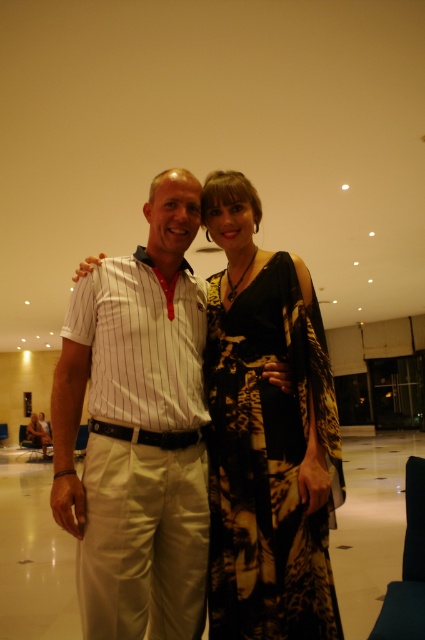
You are standing in a hotel lobby and see two people dressed in a white striped shirt at center and a black printed dress at center. Which one is positioned more to the left?

The white striped shirt at center is positioned more to the left than the black printed dress at center.

You are a photographer setting up a shoot in a hotel lobby. You notice two subjects wearing a white striped shirt at center and a black printed dress at center. Based on their heights, which clothing item should you adjust the camera angle for to ensure both are framed properly?

The white striped shirt at center is taller than the black printed dress at center, so you should adjust the camera angle to account for the height difference, likely angling it slightly downward for the taller subject wearing the white striped shirt at center to ensure both are framed properly.